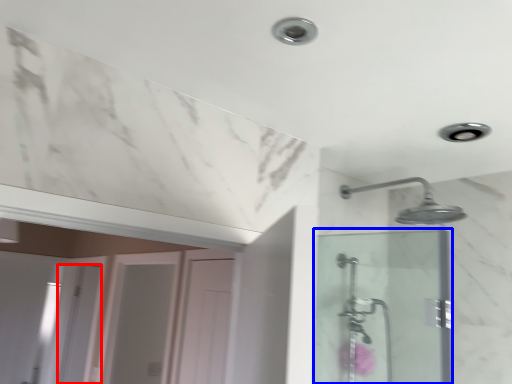
Question: Which point is further to the camera, screen door (highlighted by a red box) or screen door (highlighted by a blue box)?

Choices:
 (A) screen door
 (B) screen door

Answer: (A)